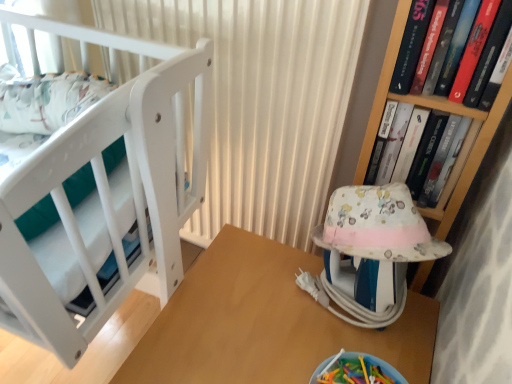
At what (x,y) coordinates should I click in order to perform the action: click on free space above wooden table at center (from a real-world perspective). Please return your answer as a coordinate pair (x, y). The height and width of the screenshot is (384, 512). Looking at the image, I should click on (280, 317).